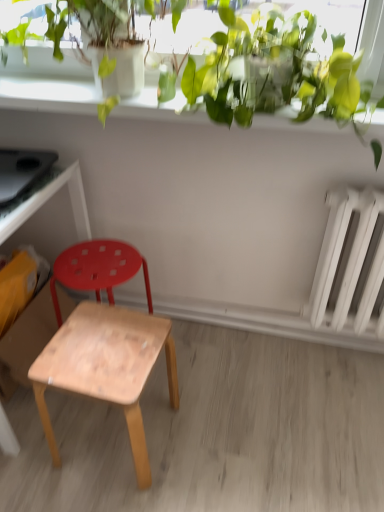
I want to click on free point above natural wood stool at center, which is the second stool in back-to-front order (from a real-world perspective), so click(94, 352).